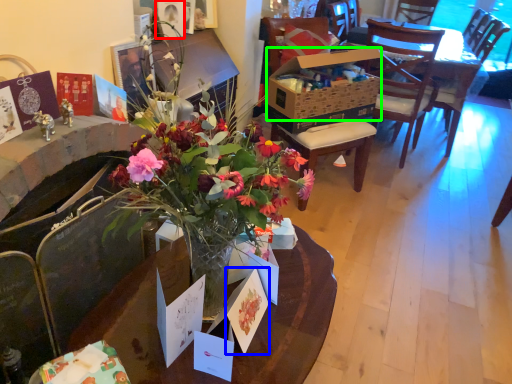
Question: Based on their relative distances, which object is nearer to picture frame (highlighted by a red box)? Choose from postcard (highlighted by a blue box) and box (highlighted by a green box).

Choices:
 (A) postcard
 (B) box

Answer: (B)